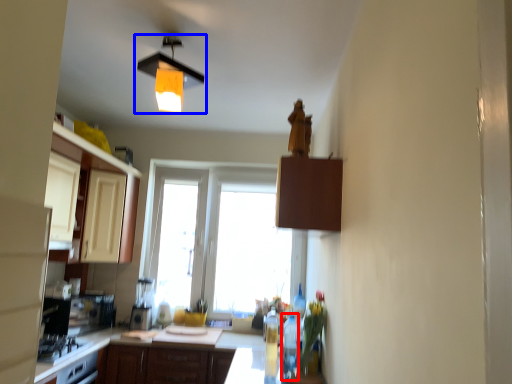
Question: Which object appears farthest to the camera in this image, bottle (highlighted by a red box) or lamp (highlighted by a blue box)?

Choices:
 (A) bottle
 (B) lamp

Answer: (A)